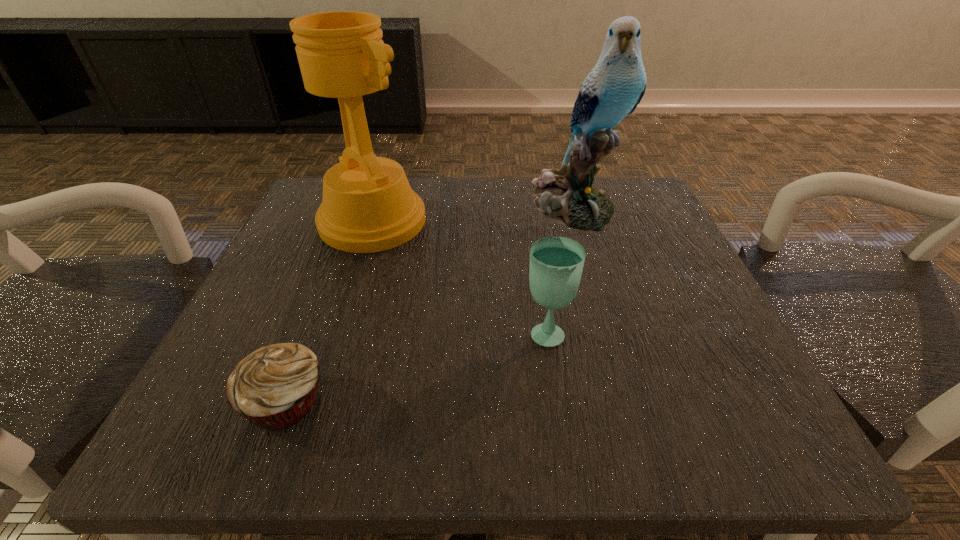
Identify the location of blank space at the near edge. The width and height of the screenshot is (960, 540). (317, 450).

Find the location of `vacant space at the left edge of the desktop`. vacant space at the left edge of the desktop is located at coordinates (312, 301).

This screenshot has height=540, width=960. Identify the location of vacant space at the right edge of the desktop. (688, 350).

Where is `vacant space at the far left corner`? vacant space at the far left corner is located at coordinates (314, 229).

I want to click on vacant area at the near left corner, so coord(213,428).

Image resolution: width=960 pixels, height=540 pixels. In the image, there is a desktop. Identify the location of vacant space at the near right corner. (710, 394).

This screenshot has height=540, width=960. In order to click on free space between the award and the third tallest object in this screenshot , I will do [460, 276].

In order to click on empty space between the parakeet and the nearest object in this screenshot , I will do `click(429, 304)`.

Where is `free space between the parakeet and the award`? This screenshot has height=540, width=960. free space between the parakeet and the award is located at coordinates (472, 214).

Identify the location of free point between the award and the second nearest object. The image size is (960, 540). (460, 276).